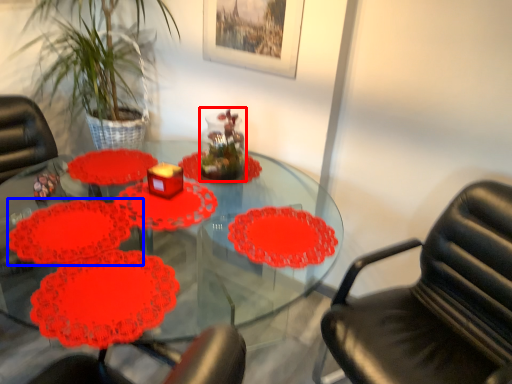
Question: Among these objects, which one is farthest to the camera, glass vase (highlighted by a red box) or flower (highlighted by a blue box)?

Choices:
 (A) glass vase
 (B) flower

Answer: (A)